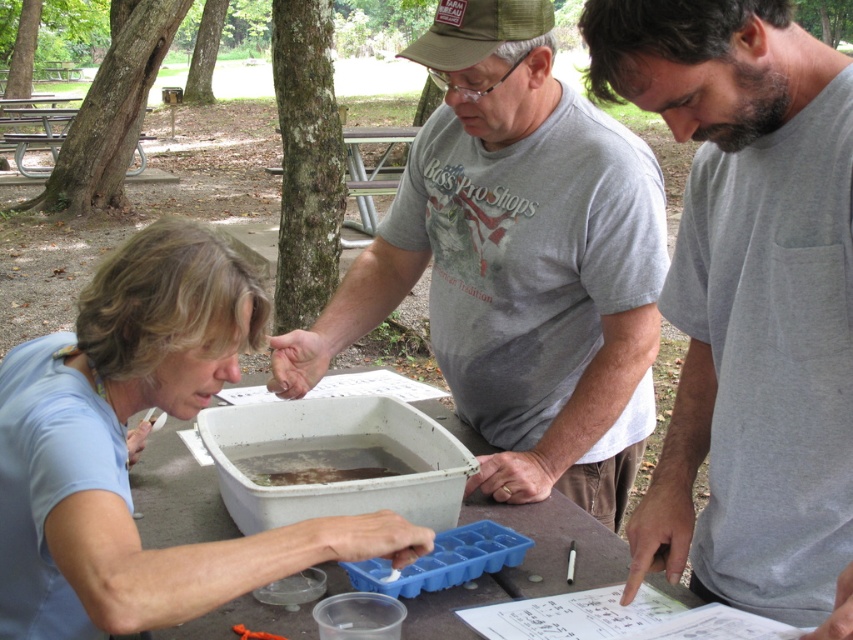
From the picture: Is the position of light blue fabric at center more distant than that of translucent plastic container at center?

No, light blue fabric at center is in front of translucent plastic container at center.

Is point (299, 531) behind point (303, 468)?

No, (299, 531) is closer to viewer.

Who is more distant from viewer, (86, 554) or (329, 468)?

The point (329, 468) is behind.

The image size is (853, 640). Find the location of `light blue fabric at center`. light blue fabric at center is located at coordinates (138, 449).

Is point (634, 275) in front of point (405, 625)?

No.

Which of these two, gray cotton t-shirt at center or white plastic table at center, stands shorter?

With less height is white plastic table at center.

Is point (625, 376) behind point (146, 634)?

Yes, it is behind point (146, 634).

The image size is (853, 640). What are the coordinates of `gray cotton t-shirt at center` in the screenshot? It's located at (517, 262).

Is light blue fabric at center above white plastic table at center?

Indeed, light blue fabric at center is positioned over white plastic table at center.

The width and height of the screenshot is (853, 640). Describe the element at coordinates (138, 449) in the screenshot. I see `light blue fabric at center` at that location.

Does point (3, 419) come farther from viewer compared to point (215, 525)?

No, (3, 419) is in front of (215, 525).

What are the coordinates of `light blue fabric at center` in the screenshot? It's located at (138, 449).